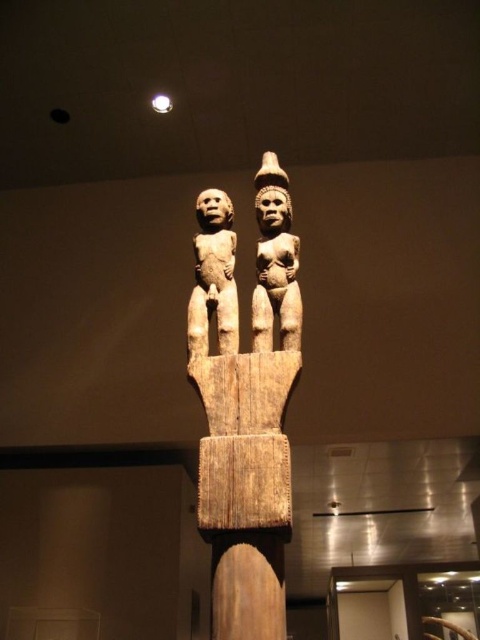
Question: Observing the image, what is the correct spatial positioning of wooden statue at center in reference to light brown wood figure at center?

Choices:
 (A) left
 (B) right

Answer: (B)

Question: Which object is closer to the camera taking this photo?

Choices:
 (A) light brown wood figure at center
 (B) wooden statue at center

Answer: (B)

Question: Which point is farther from the camera taking this photo?

Choices:
 (A) (287, 364)
 (B) (289, 264)

Answer: (B)

Question: Is wooden statue at center above light brown wood figure at center?

Choices:
 (A) no
 (B) yes

Answer: (A)

Question: Among these points, which one is farthest from the camera?

Choices:
 (A) (233, 323)
 (B) (300, 316)
 (C) (284, 244)

Answer: (C)

Question: Where is brown wooden statue at center located in relation to light brown wood figure at center in the image?

Choices:
 (A) below
 (B) above

Answer: (B)